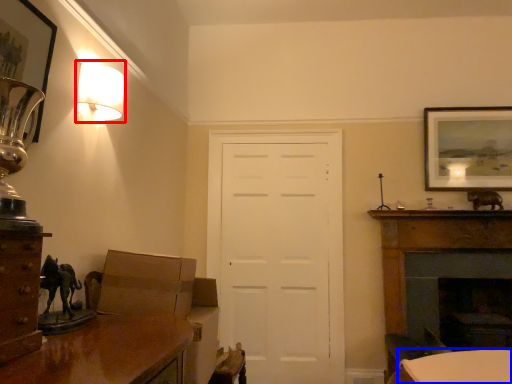
Question: Which point is closer to the camera, lamp (highlighted by a red box) or table (highlighted by a blue box)?

Choices:
 (A) lamp
 (B) table

Answer: (A)